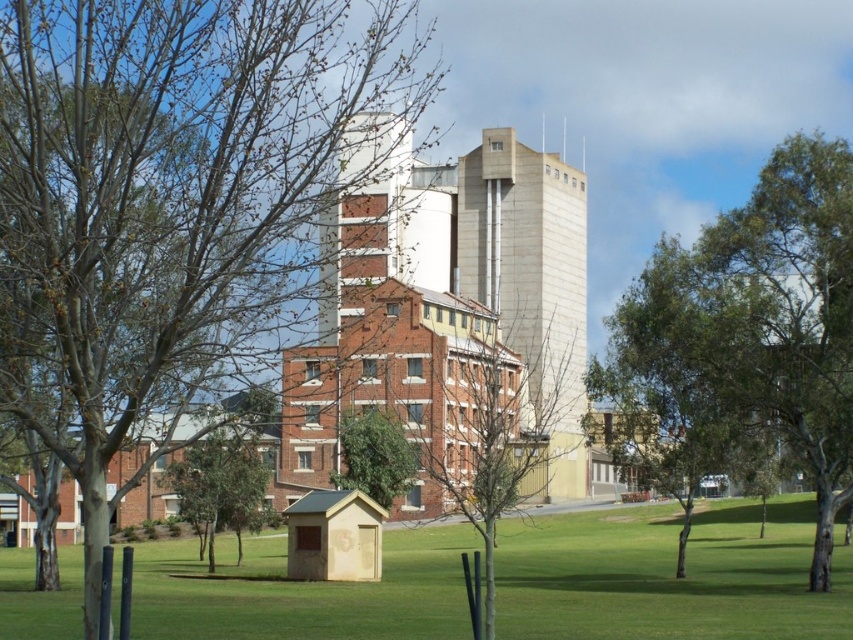
Question: Is wooden mailbox at center closer to camera compared to green leafy tree at center?

Choices:
 (A) yes
 (B) no

Answer: (A)

Question: Does green leafy tree at upper center appear on the right side of bare branches at center?

Choices:
 (A) yes
 (B) no

Answer: (A)

Question: Considering the real-world distances, which object is closest to the green leafy tree at center?

Choices:
 (A) wooden mailbox at center
 (B) green leafy tree at upper center

Answer: (A)

Question: Is brown leafy tree at left closer to camera compared to green leafy tree at center?

Choices:
 (A) yes
 (B) no

Answer: (A)

Question: Which point is closer to the camera?

Choices:
 (A) (508, 358)
 (B) (350, 465)
 (C) (712, 548)
 (D) (90, 164)

Answer: (D)

Question: Estimate the real-world distances between objects in this image. Which object is farther from the green leafy tree at upper center?

Choices:
 (A) wooden mailbox at center
 (B) bare branches at center
 (C) green leafy tree at center
 (D) brown leafy tree at left

Answer: (D)